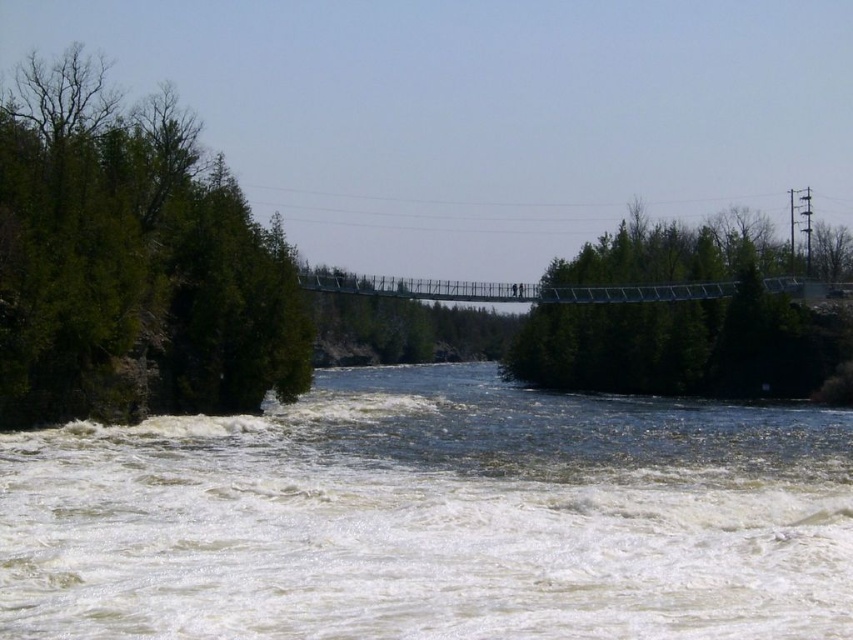
You are standing at the point marked as point (x=132, y=262) in the image, which is labeled as green leafy tree at left. You want to walk towards the suspension bridge in the center. Which direction should you head to reach the suspension bridge?

The point labeled green leafy tree at left is located at coordinates (x=132, y=262). Since the suspension bridge is in the center of the image, you should head towards the center from the left side where the tree is located. Therefore, you should move towards the right to reach the suspension bridge.

You are a photographer planning to capture the river and the trees in the scene. You want to ensure that the white frothy water at lower center and the green leafy trees at center are both visible in your shot. Based on their sizes, which object should you prioritize framing closer to the center of your photo to ensure it doesn

→ The green leafy trees at center are wider than the white frothy water at lower center. To ensure both are visible, prioritize framing the green leafy trees at center closer to the center of your photo since they are larger and might require more space to be fully captured.